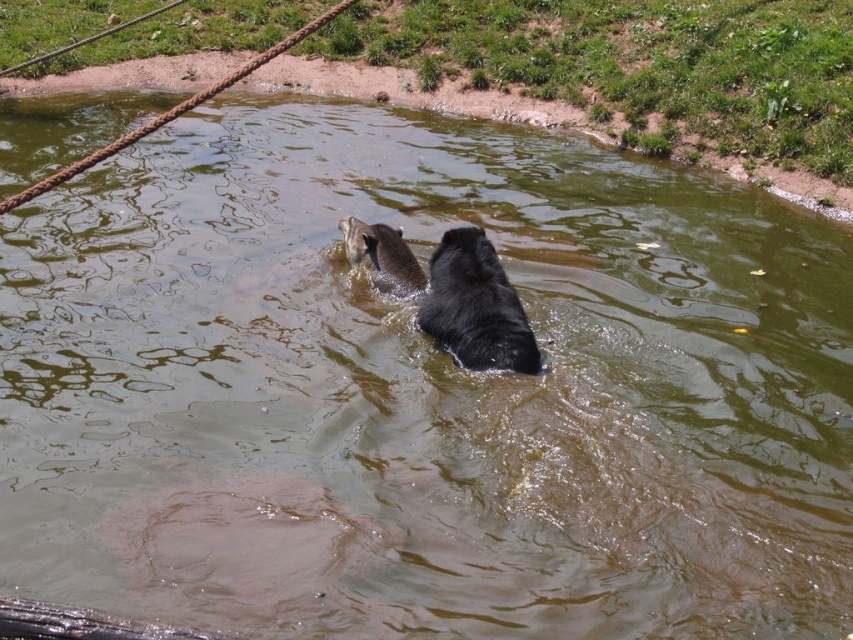
At what (x,y) coordinates should I click in order to perform the action: click on black fur dog at center. Please return your answer as a coordinate pair (x, y). Looking at the image, I should click on (474, 307).

Is black fur dog at center thinner than brown furry dog at upper center?

Incorrect, black fur dog at center's width is not less than brown furry dog at upper center's.

Between point (488, 250) and point (409, 275), which one is positioned behind?

The point (409, 275) is more distant.

Find the location of a particular element. black fur dog at center is located at coordinates (474, 307).